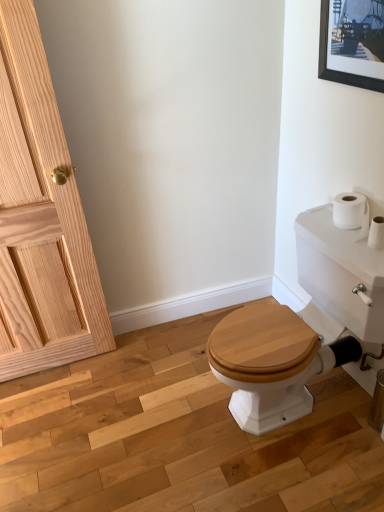
Question: From the image's perspective, is white glossy porcelain at right located above white matte toilet paper at upper right?

Choices:
 (A) yes
 (B) no

Answer: (B)

Question: Is white glossy porcelain at right thinner than white matte toilet paper at upper right?

Choices:
 (A) no
 (B) yes

Answer: (A)

Question: Does white glossy porcelain at right contain white matte toilet paper at upper right?

Choices:
 (A) no
 (B) yes

Answer: (A)

Question: Is white glossy porcelain at right smaller than white matte toilet paper at upper right?

Choices:
 (A) no
 (B) yes

Answer: (A)

Question: From the image's perspective, is white glossy porcelain at right located beneath white matte toilet paper at upper right?

Choices:
 (A) yes
 (B) no

Answer: (A)

Question: Is white glossy porcelain at right not within white matte toilet paper at upper right?

Choices:
 (A) yes
 (B) no

Answer: (A)

Question: From the image's perspective, is natural wood door at left on top of white glossy porcelain at right?

Choices:
 (A) yes
 (B) no

Answer: (A)

Question: Considering the relative sizes of natural wood door at left and white glossy porcelain at right in the image provided, is natural wood door at left taller than white glossy porcelain at right?

Choices:
 (A) no
 (B) yes

Answer: (B)

Question: Is white glossy porcelain at right at the back of natural wood door at left?

Choices:
 (A) yes
 (B) no

Answer: (B)

Question: From a real-world perspective, does natural wood door at left stand above white glossy porcelain at right?

Choices:
 (A) yes
 (B) no

Answer: (A)

Question: Is natural wood door at left completely or partially outside of white glossy porcelain at right?

Choices:
 (A) no
 (B) yes

Answer: (B)

Question: From the image's perspective, would you say natural wood door at left is shown under white glossy porcelain at right?

Choices:
 (A) yes
 (B) no

Answer: (B)

Question: From the image's perspective, would you say natural wood door at left is positioned over black matte picture frame at upper right?

Choices:
 (A) no
 (B) yes

Answer: (A)